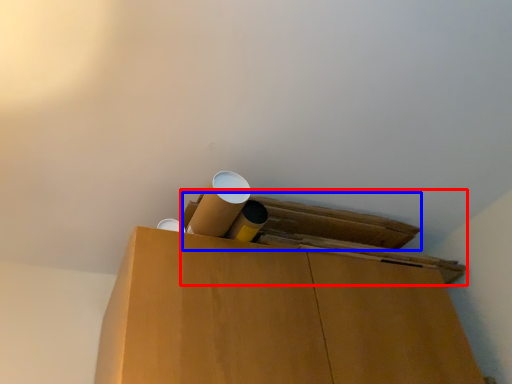
Question: Which point is closer to the camera, wide (highlighted by a red box) or wide (highlighted by a blue box)?

Choices:
 (A) wide
 (B) wide

Answer: (A)